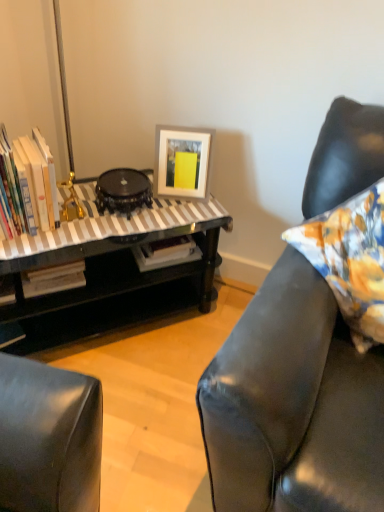
Question: From the image's perspective, is hardcover books at left located above white matte picture frame at upper center?

Choices:
 (A) yes
 (B) no

Answer: (B)

Question: Is hardcover books at left taller than white matte picture frame at upper center?

Choices:
 (A) no
 (B) yes

Answer: (B)

Question: Would you say hardcover books at left contains white matte picture frame at upper center?

Choices:
 (A) no
 (B) yes

Answer: (A)

Question: From a real-world perspective, is hardcover books at left under white matte picture frame at upper center?

Choices:
 (A) no
 (B) yes

Answer: (A)

Question: From a real-world perspective, is hardcover books at left on top of white matte picture frame at upper center?

Choices:
 (A) yes
 (B) no

Answer: (A)

Question: Which is correct: white matte picture frame at upper center is inside black glossy round table at center, or outside of it?

Choices:
 (A) inside
 (B) outside

Answer: (B)

Question: Considering the positions of white matte picture frame at upper center and black glossy round table at center in the image, is white matte picture frame at upper center taller or shorter than black glossy round table at center?

Choices:
 (A) short
 (B) tall

Answer: (B)

Question: Relative to black glossy round table at center, is white matte picture frame at upper center in front or behind?

Choices:
 (A) behind
 (B) front

Answer: (A)

Question: Looking at their shapes, would you say white matte picture frame at upper center is wider or thinner than black glossy round table at center?

Choices:
 (A) thin
 (B) wide

Answer: (A)

Question: Considering their positions, is black glossy table at left located in front of or behind white matte picture frame at upper center?

Choices:
 (A) behind
 (B) front

Answer: (B)

Question: Looking at the image, does black glossy table at left seem bigger or smaller compared to white matte picture frame at upper center?

Choices:
 (A) small
 (B) big

Answer: (B)

Question: From the image's perspective, relative to white matte picture frame at upper center, is black glossy table at left above or below?

Choices:
 (A) below
 (B) above

Answer: (A)

Question: Does point (72, 312) appear closer or farther from the camera than point (200, 138)?

Choices:
 (A) closer
 (B) farther

Answer: (B)

Question: Is hardcover books at left taller or shorter than floral fabric pillow at right?

Choices:
 (A) tall
 (B) short

Answer: (B)

Question: Is point (18, 180) closer or farther from the camera than point (360, 342)?

Choices:
 (A) farther
 (B) closer

Answer: (A)